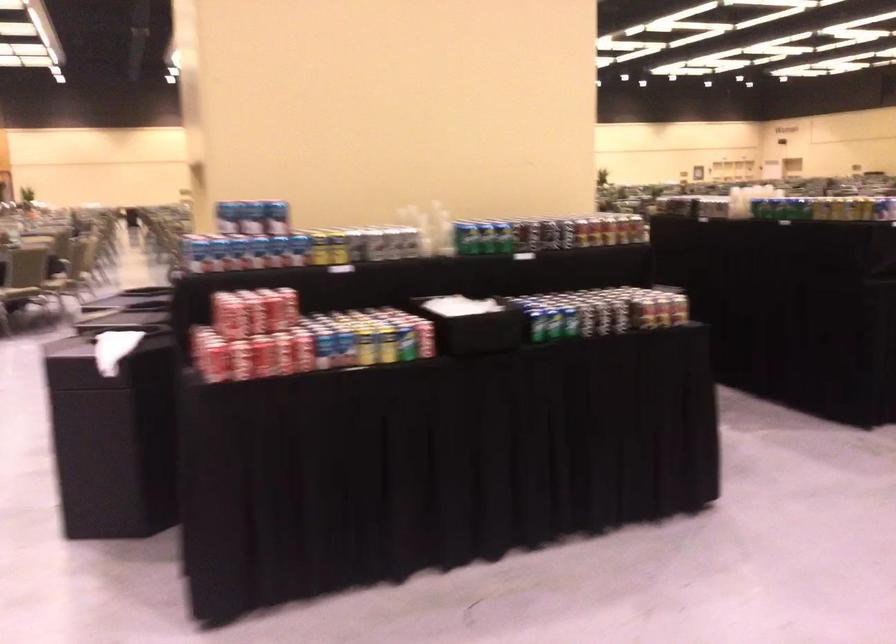
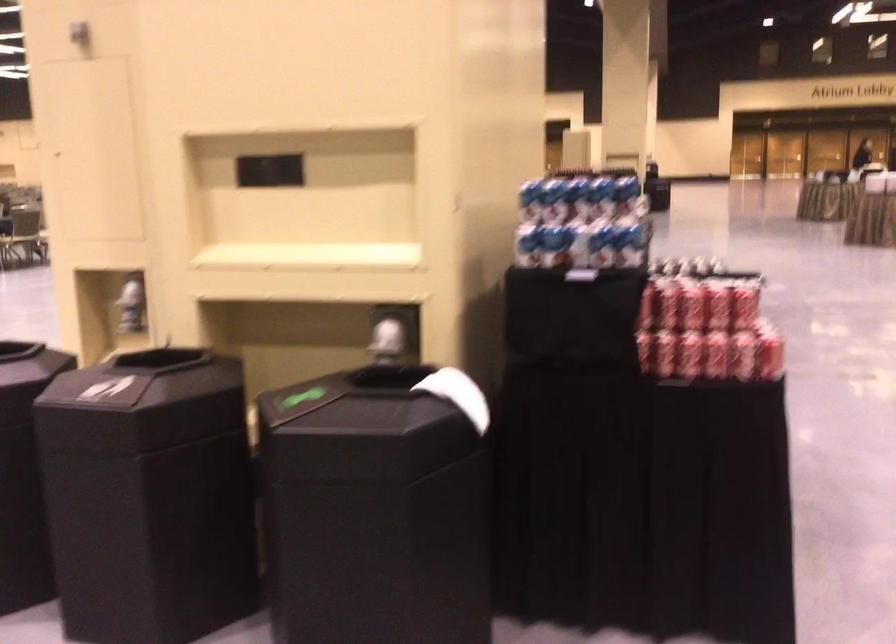
In the second image, find the point that corresponds to the point at 126,343 in the first image.

(458, 395)